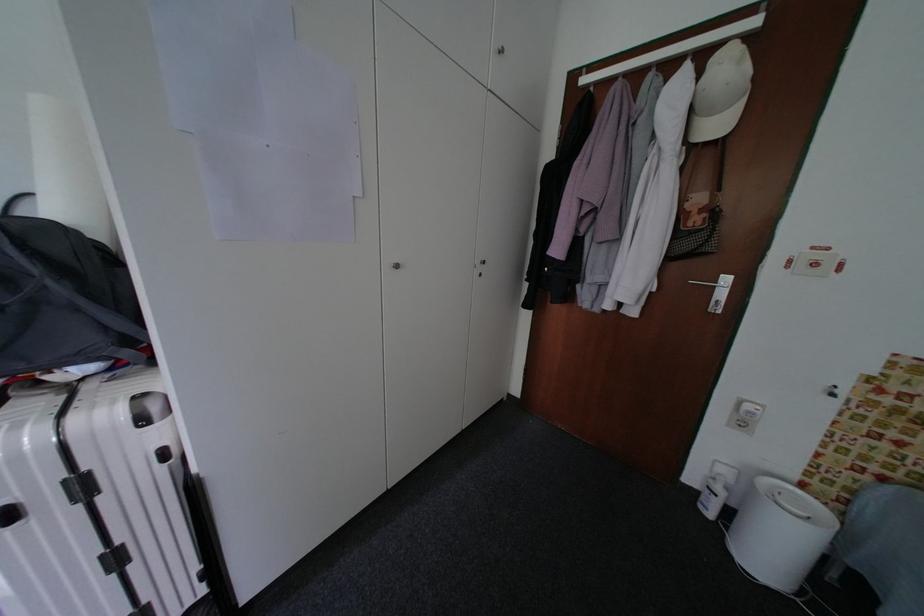
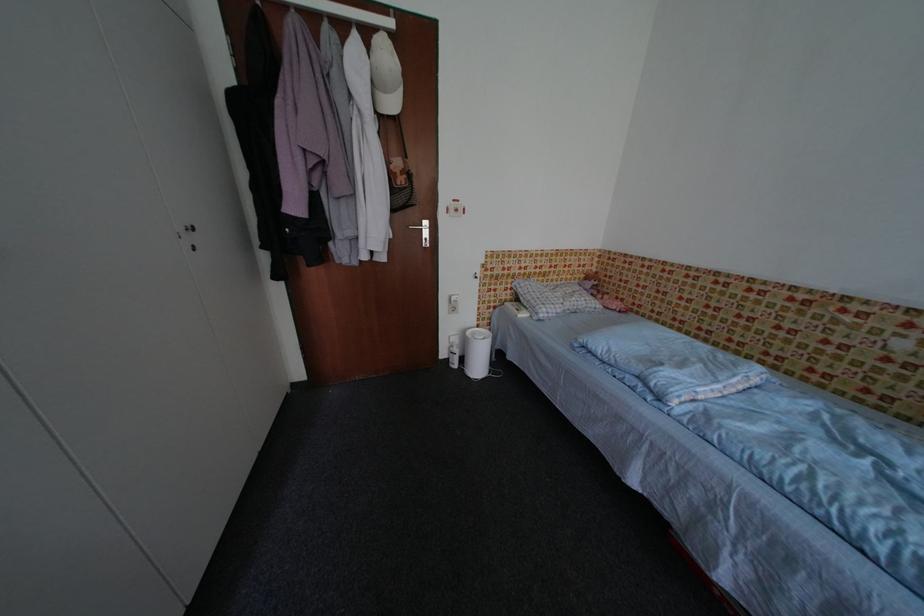
Find the pixel in the second image that matches point 725,128 in the first image.

(400, 107)